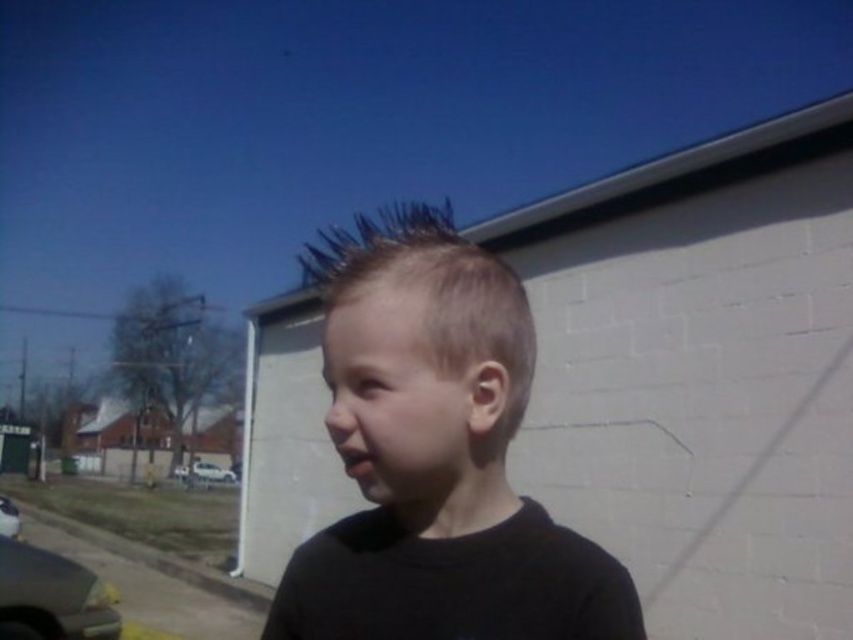
Can you confirm if blonde hair at center is shorter than silver metallic car at lower left?

Yes.

Who is positioned more to the right, blonde hair at center or silver metallic car at lower left?

Positioned to the right is blonde hair at center.

Is point (488, 620) positioned behind point (190, 476)?

That is False.

Locate an element on the screen. This screenshot has width=853, height=640. blonde hair at center is located at coordinates (434, 456).

Does metallic gray car at lower left have a lesser height compared to silver metallic car at lower left?

Yes.

Which is behind, point (20, 624) or point (178, 470)?

Point (178, 470)

Identify the location of metallic gray car at lower left. Image resolution: width=853 pixels, height=640 pixels. tap(50, 596).

Measure the distance between silver metallic car at lower left and camera.

34.03 meters

Is point (187, 468) more distant than point (10, 529)?

Yes, it is.

I want to click on silver metallic car at lower left, so click(x=204, y=474).